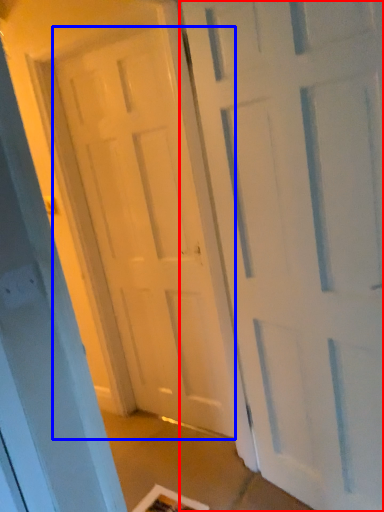
Question: Which object is closer to the camera taking this photo, door (highlighted by a red box) or door (highlighted by a blue box)?

Choices:
 (A) door
 (B) door

Answer: (A)